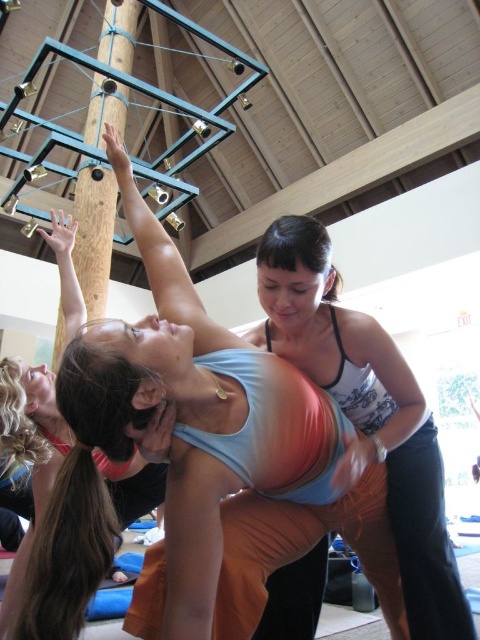
Is matte blue tank top at center taller than matte black tank top at center?

Yes, matte blue tank top at center is taller than matte black tank top at center.

Can you confirm if matte blue tank top at center is bigger than matte black tank top at center?

Yes.

Measure the distance between matte blue tank top at center and camera.

The distance of matte blue tank top at center from camera is 1.05 meters.

Where is `matte blue tank top at center`? The width and height of the screenshot is (480, 640). matte blue tank top at center is located at coordinates (254, 547).

Based on the photo, which of these two, matte blue tank top at center or matte pink tank top at upper left, stands taller?

matte pink tank top at upper left

Image resolution: width=480 pixels, height=640 pixels. Identify the location of matte blue tank top at center. (254, 547).

Which is behind, point (162, 348) or point (146, 497)?

The point (146, 497) is behind.

I want to click on matte blue tank top at center, so click(254, 547).

Does point (403, 500) come in front of point (69, 339)?

Yes, it is.

The image size is (480, 640). Find the location of `matte black tank top at center`. matte black tank top at center is located at coordinates (367, 412).